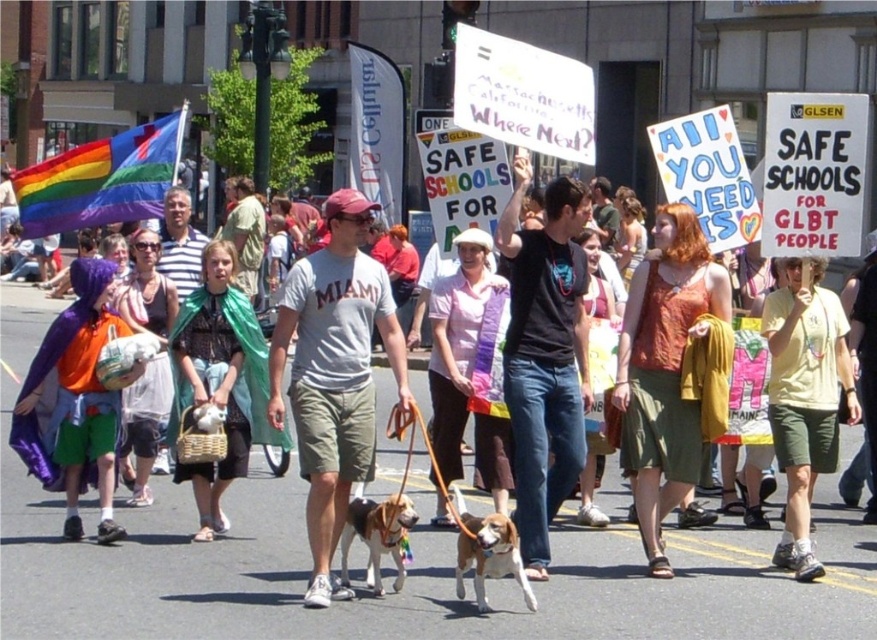
Question: Is the position of yellow cotton t-shirt at center less distant than that of brown and white fur at center?

Choices:
 (A) no
 (B) yes

Answer: (A)

Question: Which of the following is the closest to the observer?

Choices:
 (A) (305, 292)
 (B) (384, 525)
 (C) (781, 410)

Answer: (B)

Question: Which point is farther to the camera?

Choices:
 (A) yellow cotton t-shirt at center
 (B) gray cotton t-shirt at center
 (C) black cotton t-shirt at center

Answer: (A)

Question: Considering the relative positions of gray cotton t-shirt at center and yellow cotton t-shirt at center in the image provided, where is gray cotton t-shirt at center located with respect to yellow cotton t-shirt at center?

Choices:
 (A) right
 (B) left

Answer: (B)

Question: Can you confirm if black cotton t-shirt at center is positioned to the left of light brown fur at center?

Choices:
 (A) yes
 (B) no

Answer: (B)

Question: Among these objects, which one is farthest from the camera?

Choices:
 (A) yellow cotton t-shirt at center
 (B) gray cotton t-shirt at center
 (C) light brown fur at center

Answer: (A)